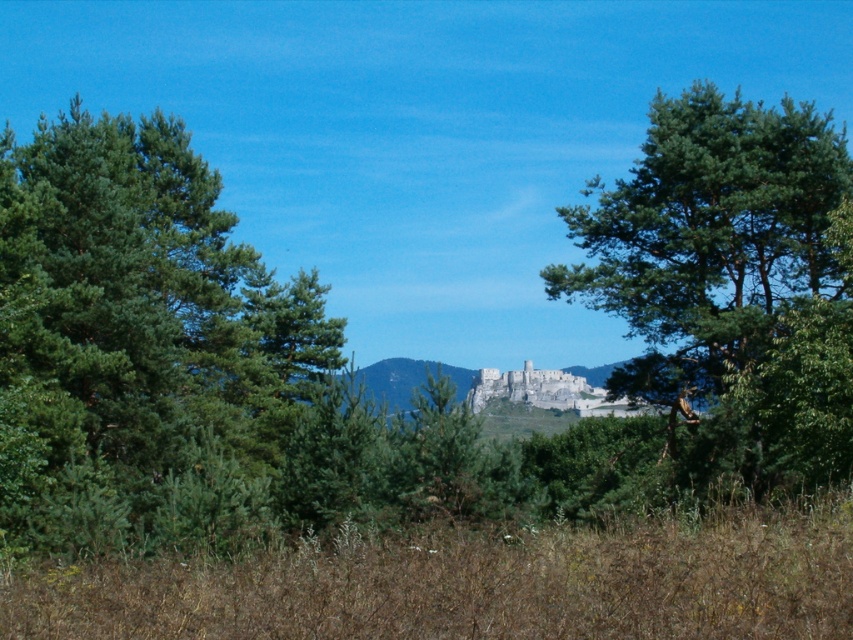
Between green matte tree at left and green leafy tree at center, which one appears on the right side from the viewer's perspective?

From the viewer's perspective, green leafy tree at center appears more on the right side.

Can you confirm if green matte tree at left is bigger than green leafy tree at center?

Indeed, green matte tree at left has a larger size compared to green leafy tree at center.

Does point (47, 276) come farther from viewer compared to point (724, 280)?

No, it is not.

Find the location of a particular element. Image resolution: width=853 pixels, height=640 pixels. green matte tree at left is located at coordinates (138, 342).